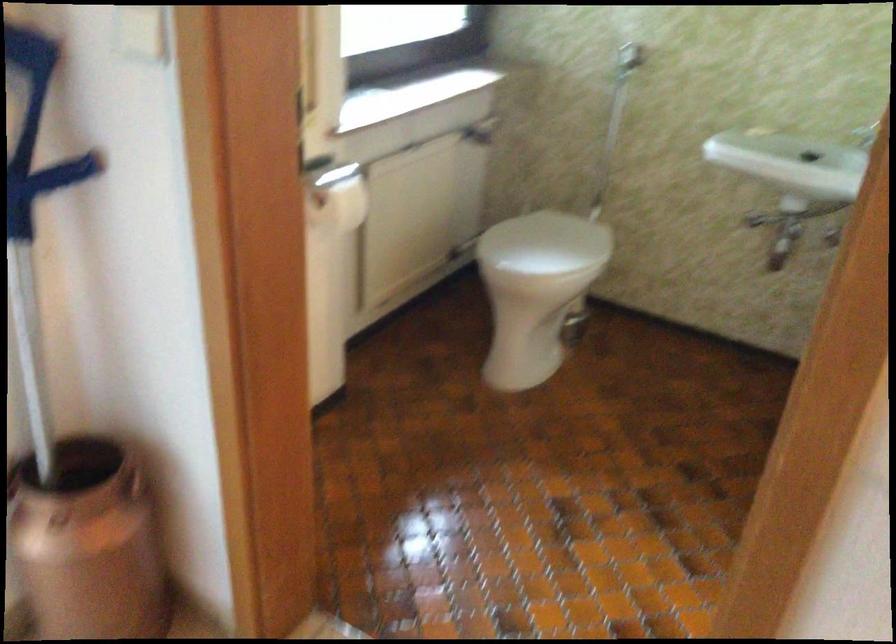
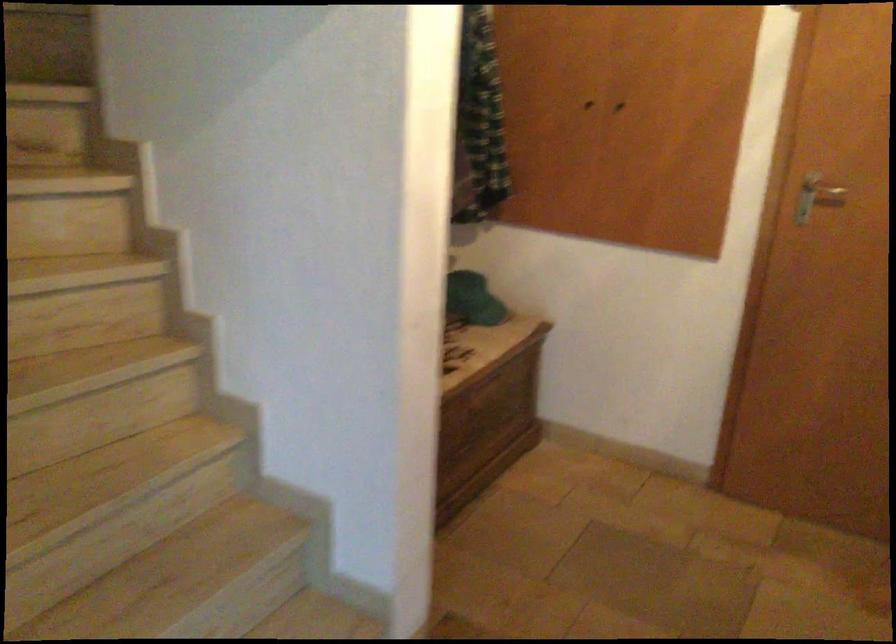
From the picture: The first image is from the beginning of the video and the second image is from the end. How did the camera likely rotate when shooting the video?

The camera's rotation is toward right-down.